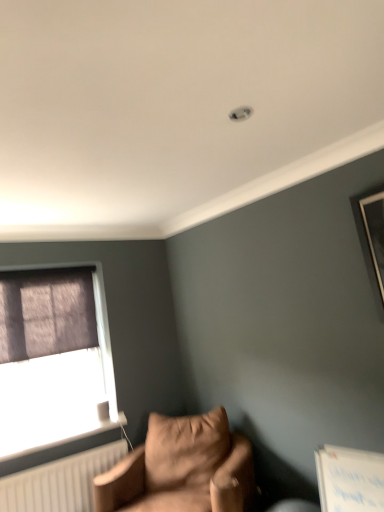
Question: From the image's perspective, relative to suede-like brown armchair at lower left, is white plastic radiator at lower left above or below?

Choices:
 (A) below
 (B) above

Answer: (B)

Question: Looking at their shapes, would you say white plastic radiator at lower left is wider or thinner than suede-like brown armchair at lower left?

Choices:
 (A) wide
 (B) thin

Answer: (B)

Question: Which is farther from the matte purple curtain at left?

Choices:
 (A) suede-like brown armchair at lower left
 (B) dark purple fabric at left
 (C) white plastic radiator at lower left

Answer: (A)

Question: Which is farther from the dark purple fabric at left?

Choices:
 (A) matte purple curtain at left
 (B) white plastic radiator at lower left
 (C) suede-like brown armchair at lower left

Answer: (C)